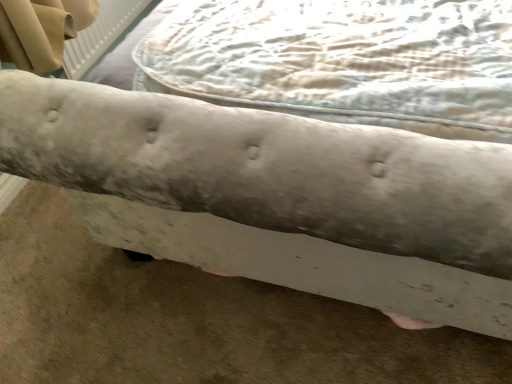
Question: Is light beige textured mattress at center at the right side of frosted glass bench at center?

Choices:
 (A) yes
 (B) no

Answer: (B)

Question: From a real-world perspective, is light beige textured mattress at center located higher than frosted glass bench at center?

Choices:
 (A) yes
 (B) no

Answer: (A)

Question: Are light beige textured mattress at center and frosted glass bench at center making contact?

Choices:
 (A) no
 (B) yes

Answer: (A)

Question: From the image's perspective, is light beige textured mattress at center on frosted glass bench at center?

Choices:
 (A) yes
 (B) no

Answer: (B)

Question: Can you confirm if light beige textured mattress at center is shorter than frosted glass bench at center?

Choices:
 (A) no
 (B) yes

Answer: (B)

Question: Would you say light beige textured mattress at center contains frosted glass bench at center?

Choices:
 (A) yes
 (B) no

Answer: (B)

Question: Is frosted glass bench at center taller than light beige textured mattress at center?

Choices:
 (A) yes
 (B) no

Answer: (A)

Question: Is frosted glass bench at center oriented towards light beige textured mattress at center?

Choices:
 (A) yes
 (B) no

Answer: (A)

Question: From the image's perspective, is frosted glass bench at center on top of light beige textured mattress at center?

Choices:
 (A) yes
 (B) no

Answer: (A)

Question: Does frosted glass bench at center have a smaller size compared to light beige textured mattress at center?

Choices:
 (A) yes
 (B) no

Answer: (B)

Question: Can you confirm if frosted glass bench at center is bigger than light beige textured mattress at center?

Choices:
 (A) yes
 (B) no

Answer: (A)

Question: Does frosted glass bench at center contain light beige textured mattress at center?

Choices:
 (A) yes
 (B) no

Answer: (A)

Question: From a real-world perspective, is light beige textured mattress at center above or below frosted glass bench at center?

Choices:
 (A) above
 (B) below

Answer: (A)